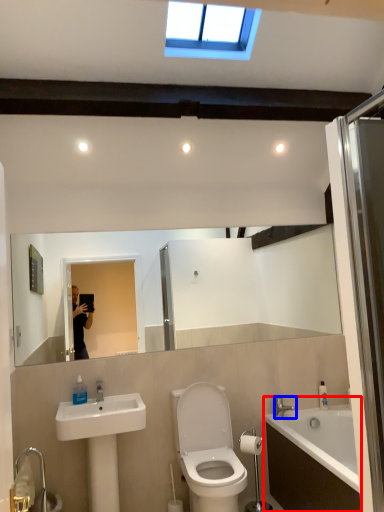
Question: Which object appears farthest to the camera in this image, bathtub (highlighted by a red box) or tap (highlighted by a blue box)?

Choices:
 (A) bathtub
 (B) tap

Answer: (B)